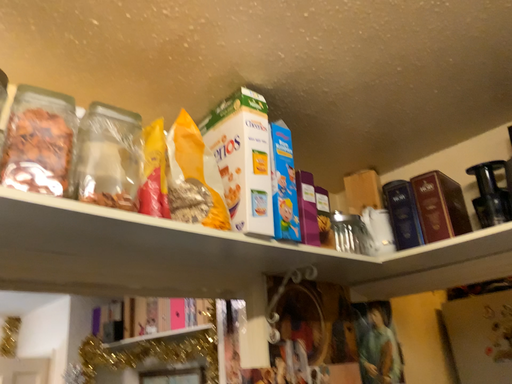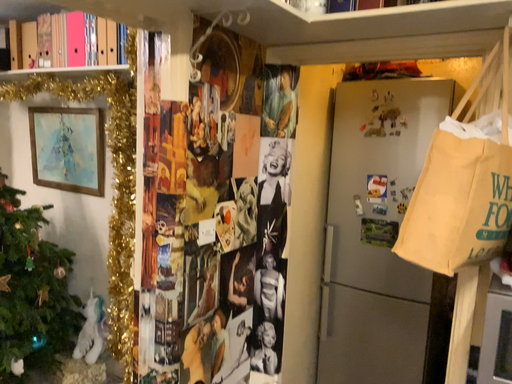
Question: Which way did the camera rotate in the video?

Choices:
 (A) rotated right
 (B) rotated left

Answer: (A)